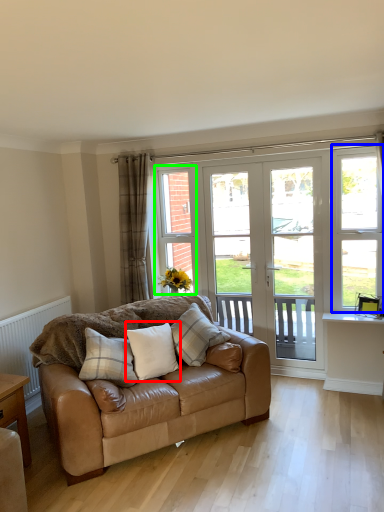
Question: Based on their relative distances, which object is nearer to pillow (highlighted by a red box)? Choose from window frame (highlighted by a blue box) and window (highlighted by a green box).

Choices:
 (A) window frame
 (B) window

Answer: (B)